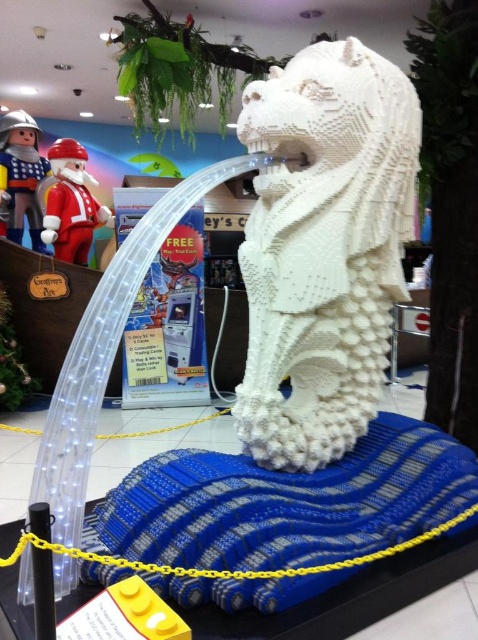
Question: Can you confirm if matte plastic santa at upper left is bigger than metallic silver toy soldier at upper left?

Choices:
 (A) yes
 (B) no

Answer: (A)

Question: Is matte plastic santa at upper left smaller than metallic silver toy soldier at upper left?

Choices:
 (A) yes
 (B) no

Answer: (B)

Question: Does matte plastic santa at upper left have a greater width compared to metallic silver toy soldier at upper left?

Choices:
 (A) no
 (B) yes

Answer: (B)

Question: Which object appears closest to the camera in this image?

Choices:
 (A) white lego sculpture at center
 (B) matte plastic santa at upper left
 (C) metallic silver toy soldier at upper left

Answer: (A)

Question: Among these objects, which one is farthest from the camera?

Choices:
 (A) metallic silver toy soldier at upper left
 (B) white lego sculpture at center
 (C) matte plastic santa at upper left

Answer: (A)

Question: Which of the following is the closest to the observer?

Choices:
 (A) white lego sculpture at center
 (B) metallic silver toy soldier at upper left
 (C) matte plastic santa at upper left

Answer: (A)